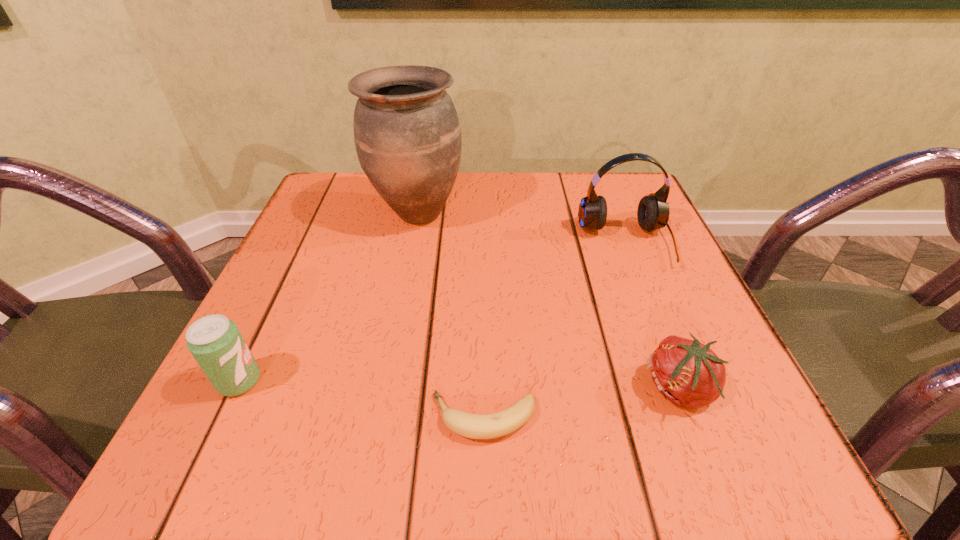
Locate an element on the screen. empty location between the fourth tallest object and the fourth shortest object is located at coordinates (653, 316).

At what (x,y) coordinates should I click in order to perform the action: click on vacant space that's between the headset and the urn. Please return your answer as a coordinate pair (x, y). The height and width of the screenshot is (540, 960). Looking at the image, I should click on (521, 228).

Find the location of `blank region between the tomato and the headset`. blank region between the tomato and the headset is located at coordinates (653, 316).

The image size is (960, 540). Identify the location of vacant area that lies between the tomato and the soda. (460, 385).

You are a GUI agent. You are given a task and a screenshot of the screen. Output one action in this format:
    pyautogui.click(x=<x>, y=<y>)
    Task: Click on the vacant region between the banana and the headset
    
    Given the screenshot: What is the action you would take?
    pyautogui.click(x=555, y=330)

The height and width of the screenshot is (540, 960). I want to click on vacant space that's between the tomato and the shortest object, so [582, 403].

Find the location of a particular element. The width and height of the screenshot is (960, 540). blank region between the banana and the tallest object is located at coordinates (450, 315).

Where is `vacant point located between the third tallest object and the tomato`? The width and height of the screenshot is (960, 540). vacant point located between the third tallest object and the tomato is located at coordinates (460, 385).

The height and width of the screenshot is (540, 960). I want to click on vacant area that lies between the banana and the soda, so click(361, 400).

Where is `unoccupied area between the urn and the headset`? unoccupied area between the urn and the headset is located at coordinates (521, 228).